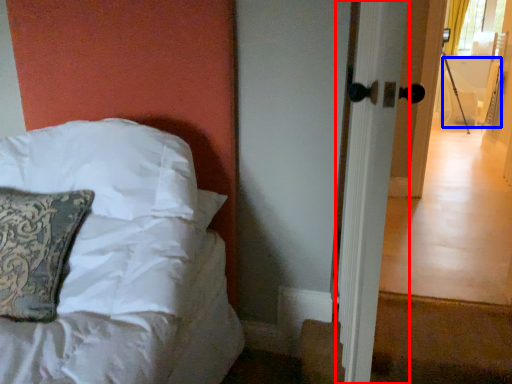
Question: Among these objects, which one is farthest to the camera, screen door (highlighted by a red box) or armchair (highlighted by a blue box)?

Choices:
 (A) screen door
 (B) armchair

Answer: (B)